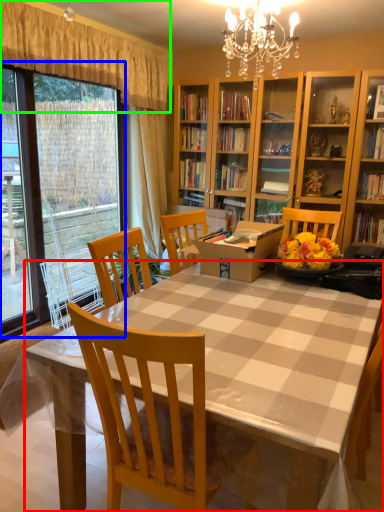
Question: Based on their relative distances, which object is nearer to desk (highlighted by a red box)? Choose from glass door (highlighted by a blue box) and curtain (highlighted by a green box).

Choices:
 (A) glass door
 (B) curtain

Answer: (A)